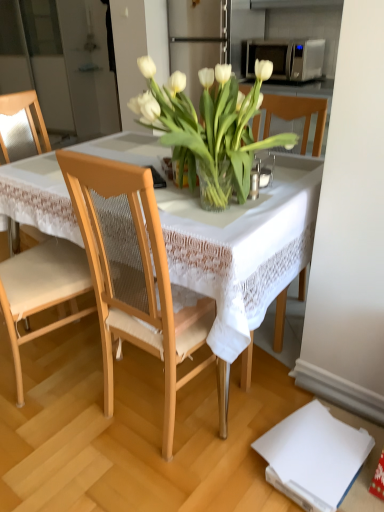
Locate an element on the screen. This screenshot has width=384, height=512. vacant region in front of light wood chair at center, which ranks as the second chair in left-to-right order is located at coordinates (165, 473).